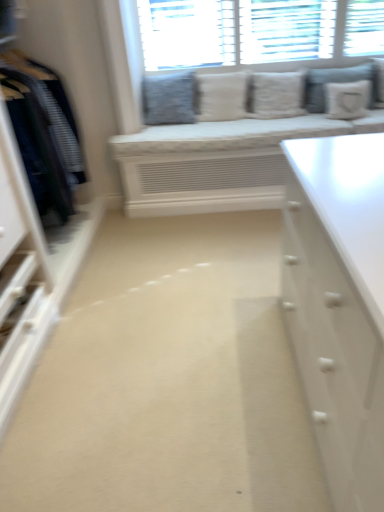
Where is `free point above white fabric pillow at upper right, the fifth pillow when ordered from left to right (from a real-world perspective)`? free point above white fabric pillow at upper right, the fifth pillow when ordered from left to right (from a real-world perspective) is located at coordinates (347, 82).